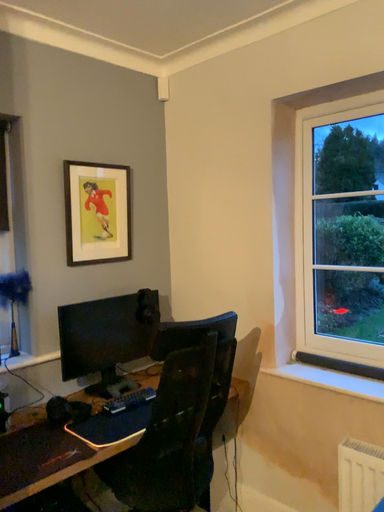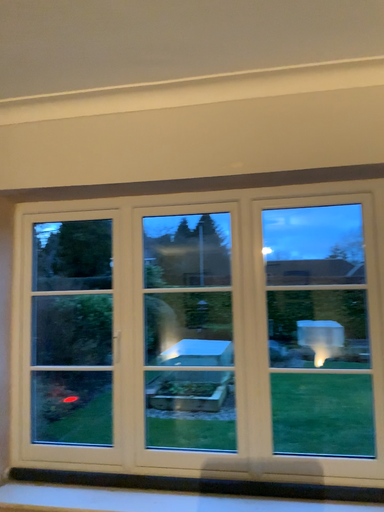
Question: Which way did the camera rotate in the video?

Choices:
 (A) rotated left
 (B) rotated right

Answer: (B)